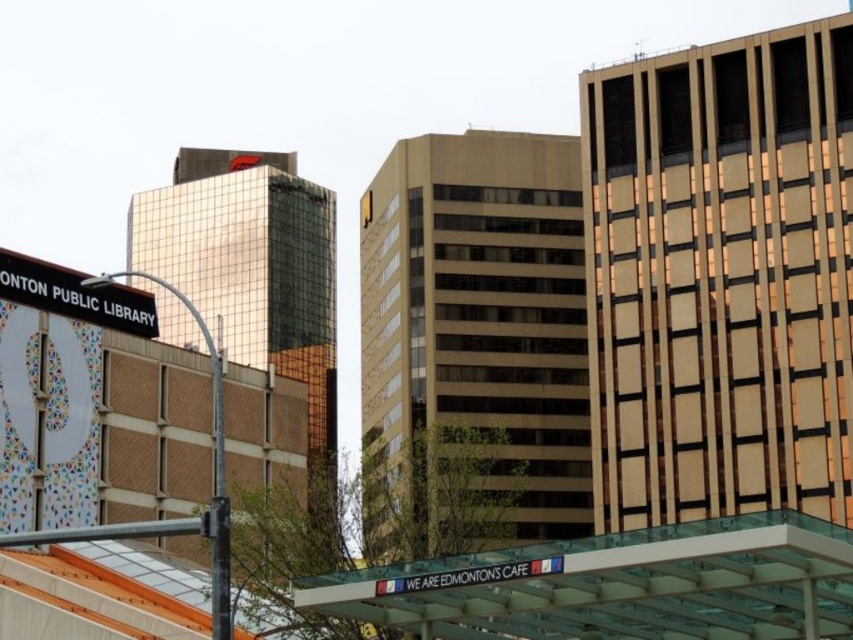
You are a delivery person trying to hang a new menu board on the black metal sign at upper left and the metallic pole at left. Which object will require a wider base to support the board?

The metallic pole at left will require a wider base because it is thicker than the black metal sign at upper left.

Based on the photo, you are a delivery person carrying a package and need to reach the entrance of EDMONTON CAFE. You see the transparent glass canopy at lower center and the metallic pole at left. Which object is closer to the entrance of the cafe?

The transparent glass canopy at lower center is closer to the entrance of the cafe because it is positioned below the metallic pole at left, indicating it is in front of the pole and closer to the entrance.

You are standing at the entrance of the city plaza and see the black metal sign at upper left. If you walk straight ahead, will the sign remain visible in your line of sight?

The black metal sign at upper left is located at point (74, 296), so if you walk straight ahead, the sign will likely remain visible in your line of sight as it is positioned to the upper left and not directly in front of you.